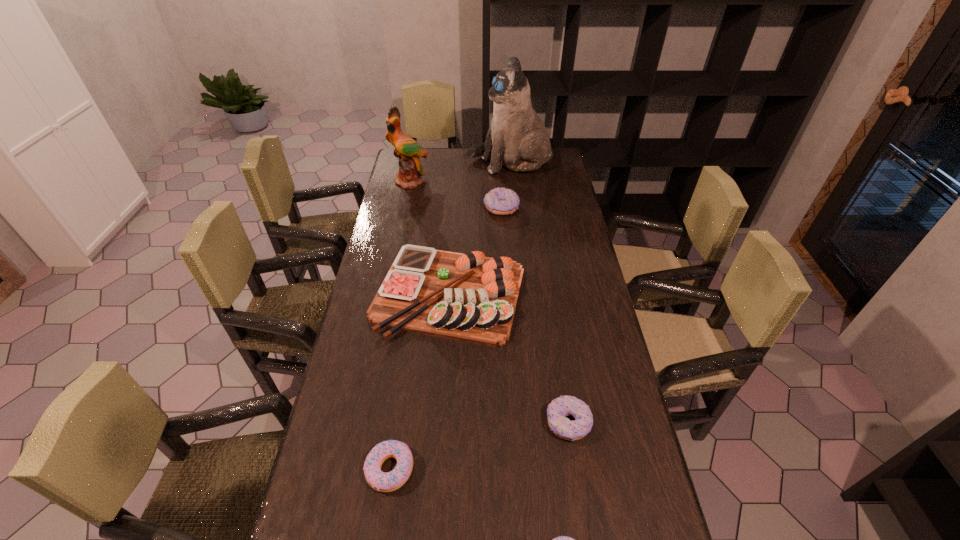
I want to click on parrot positioned at the far edge, so click(408, 151).

Locate an element on the screen. Image resolution: width=960 pixels, height=540 pixels. parrot that is at the left edge is located at coordinates (408, 151).

Where is `platter situated at the left edge`? The width and height of the screenshot is (960, 540). platter situated at the left edge is located at coordinates (468, 297).

Where is `doughnut positioned at the left edge`? doughnut positioned at the left edge is located at coordinates (383, 482).

This screenshot has height=540, width=960. I want to click on cat at the right edge, so click(x=517, y=137).

Locate an element on the screen. doughnut at the right edge is located at coordinates (559, 408).

Where is `object that is positioned at the far left corner`? Image resolution: width=960 pixels, height=540 pixels. object that is positioned at the far left corner is located at coordinates (408, 151).

Find the location of `object situated at the far right corner`. object situated at the far right corner is located at coordinates (517, 137).

In the image, there is a desktop. Identify the location of vacant space at the far edge. This screenshot has width=960, height=540. (x=438, y=163).

Locate an element on the screen. vacant space at the left edge of the desktop is located at coordinates (385, 207).